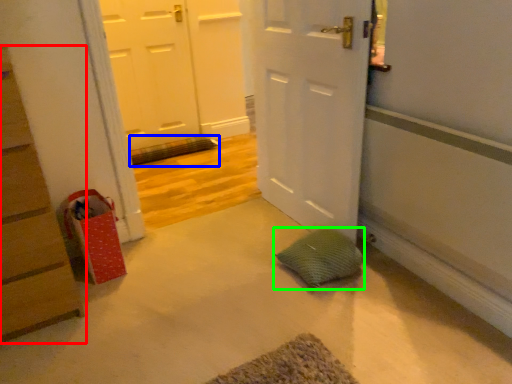
Question: Which object is the farthest from chest of drawers (highlighted by a red box)? Choose among these: bath mat (highlighted by a blue box) or pillow (highlighted by a green box).

Choices:
 (A) bath mat
 (B) pillow

Answer: (A)